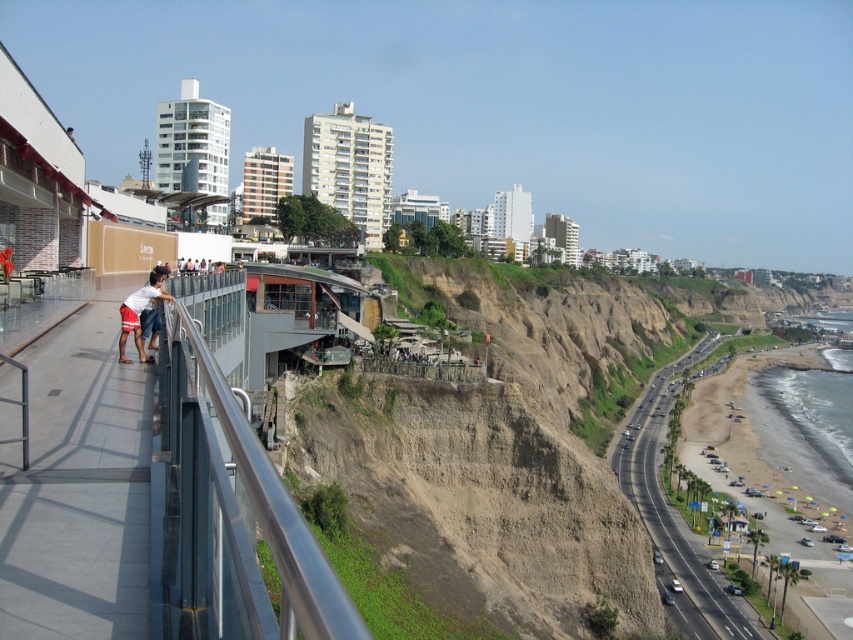
You are standing on the cliffside walkway and notice both the smooth concrete walkway at left and the matte white shorts at left. Which object is nearer to you?

The smooth concrete walkway at left is closer to the viewer than the matte white shorts at left, so the smooth concrete walkway at left is nearer to you.

You are standing on a cliff overlooking the coast and see the transparent glass railing at left and the matte white shorts at left. Which object is located to the right of the other?

The transparent glass railing at left is positioned on the right side of matte white shorts at left, so the transparent glass railing at left is to the right of the matte white shorts at left.

You are a maintenance worker needing to walk from the smooth concrete walkway at left to the transparent glass railing at left to inspect it. Considering your average stride length is 0.75 meters, how many steps will you need to take to reach the railing from the walkway?

The distance between the smooth concrete walkway at left and the transparent glass railing at left is 4.34 meters. With a stride length of 0.75 meters, dividing 4.34 by 0.75 gives approximately 5.79 steps. Since you can only take whole steps, you would need to take 6 steps to reach the transparent glass railing at left from the smooth concrete walkway at left.